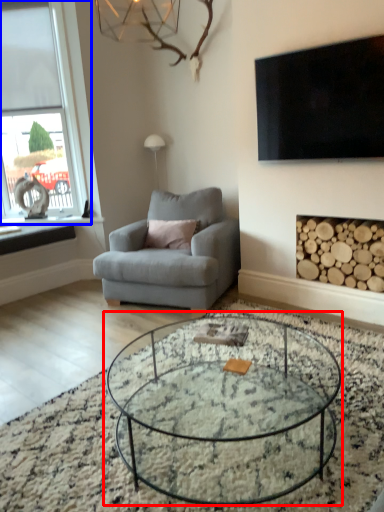
Question: Among these objects, which one is nearest to the camera, coffee table (highlighted by a red box) or window (highlighted by a blue box)?

Choices:
 (A) coffee table
 (B) window

Answer: (A)